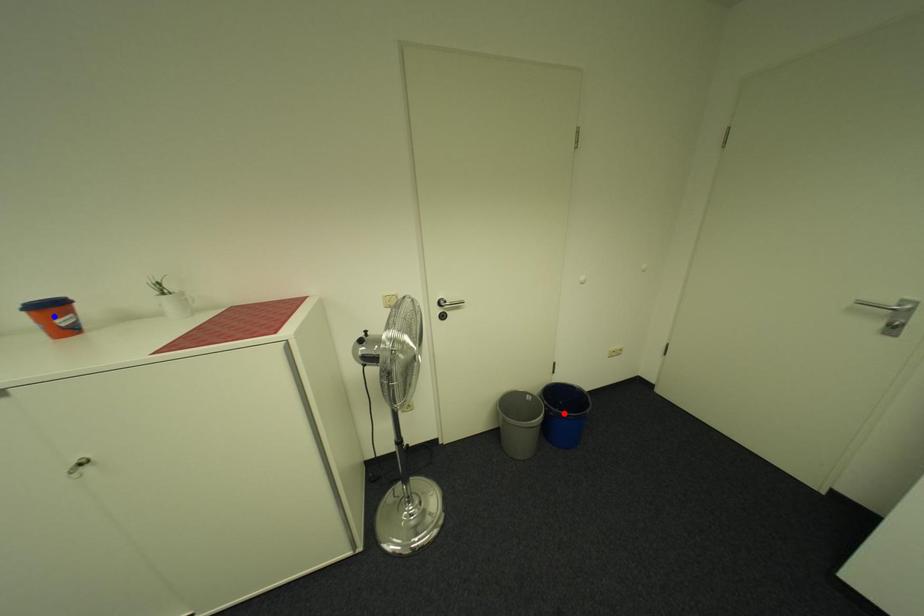
Question: In the image, two points are highlighted. Which point is nearer to the camera? Reply with the corresponding letter.

Choices:
 (A) blue point
 (B) red point

Answer: (A)